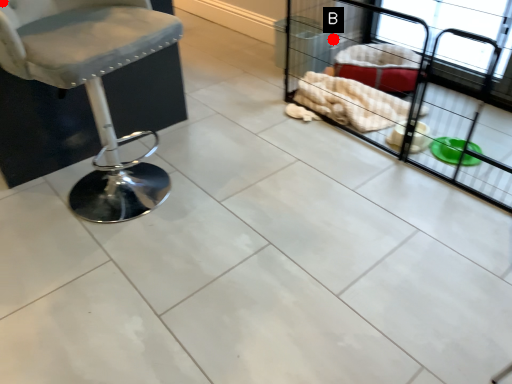
Question: Two points are circled on the image, labeled by A and B beside each circle. Which point is closer to the camera?

Choices:
 (A) A is closer
 (B) B is closer

Answer: (A)